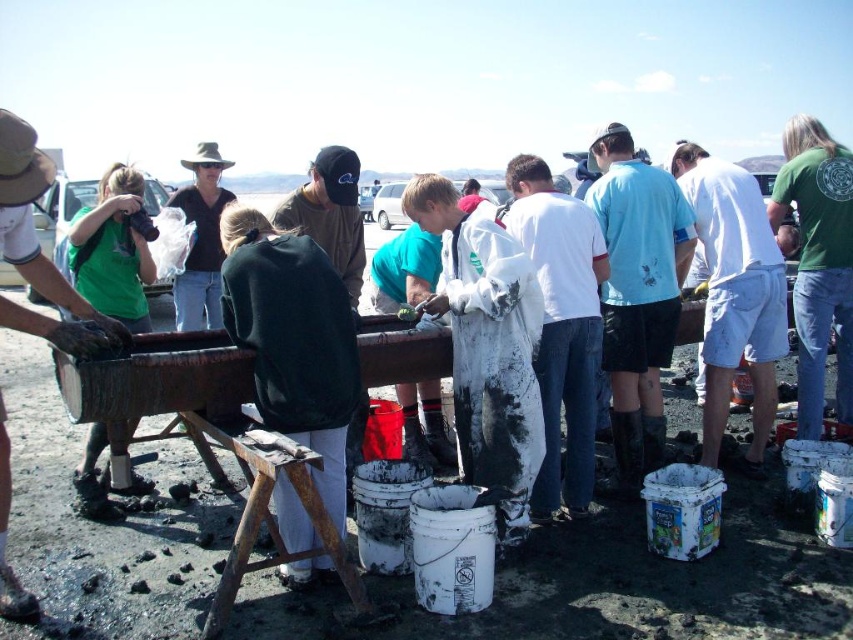
Is white matte t-shirt at center to the right of matte black shirt at left from the viewer's perspective?

Yes, white matte t-shirt at center is to the right of matte black shirt at left.

Between white matte t-shirt at center and matte black shirt at left, which one has more height?

With more height is white matte t-shirt at center.

Does point (556, 244) come behind point (0, 108)?

That is True.

Where is `white matte t-shirt at center`? The height and width of the screenshot is (640, 853). white matte t-shirt at center is located at coordinates (561, 328).

Who is taller, white matte coat at center or white matte t-shirt at center?

Standing taller between the two is white matte t-shirt at center.

In the scene shown: Who is positioned more to the right, white matte coat at center or white matte t-shirt at center?

Positioned to the right is white matte t-shirt at center.

The image size is (853, 640). What do you see at coordinates (486, 348) in the screenshot? I see `white matte coat at center` at bounding box center [486, 348].

Where is `white matte coat at center`? white matte coat at center is located at coordinates (486, 348).

Looking at this image, between light blue t-shirt at center and rusty wood stool at lower center, which one has more height?

light blue t-shirt at center

Which is below, light blue t-shirt at center or rusty wood stool at lower center?

rusty wood stool at lower center

Is point (612, 316) more distant than point (271, 563)?

Yes.

You are a GUI agent. You are given a task and a screenshot of the screen. Output one action in this format:
    pyautogui.click(x=<x>, y=<y>)
    Task: Click on the light blue t-shirt at center
    This screenshot has width=853, height=640.
    Given the screenshot: What is the action you would take?
    pyautogui.click(x=637, y=296)